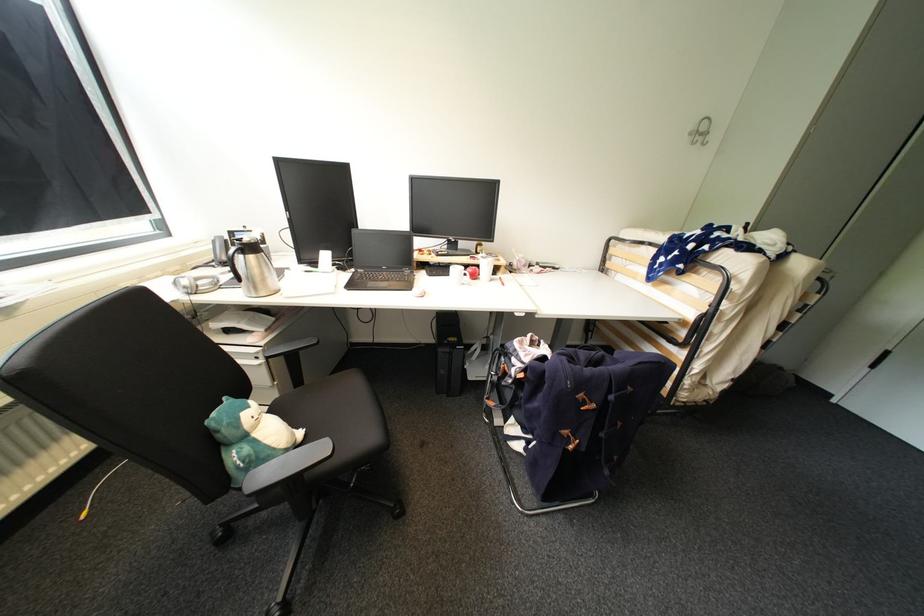
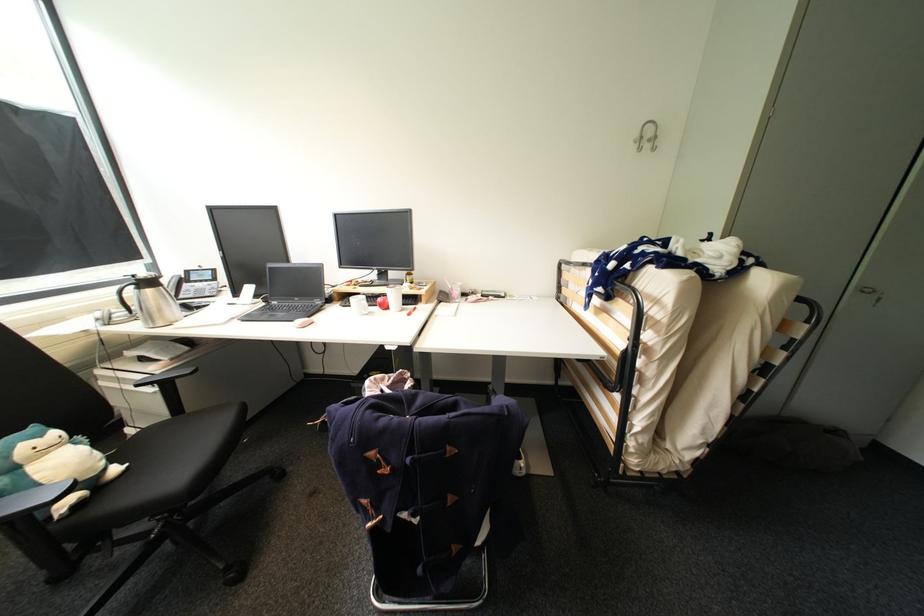
Question: In a continuous first-person perspective shot, in which direction is the camera moving?

Choices:
 (A) Left
 (B) Right
 (C) Forward
 (D) Backward

Answer: (B)